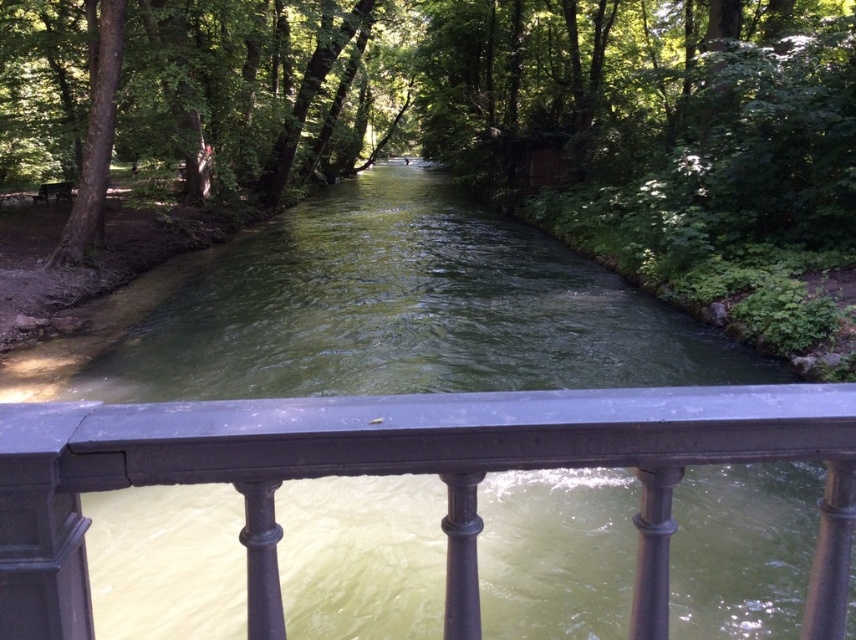
Who is more forward, (x=747, y=108) or (x=125, y=428)?

Point (x=125, y=428) is more forward.

Is green leafy tree at center to the right of black metal railing at center from the viewer's perspective?

In fact, green leafy tree at center is to the left of black metal railing at center.

Between point (544, 92) and point (807, 428), which one is positioned behind?

Positioned behind is point (544, 92).

Where is `green leafy tree at center`? green leafy tree at center is located at coordinates [x=453, y=100].

Between black metal railing at center and green leafy tree at left, which one appears on the left side from the viewer's perspective?

Positioned to the left is green leafy tree at left.

Between point (300, 410) and point (104, 189), which one is positioned in front?

Positioned in front is point (300, 410).

Where is `black metal railing at center`? This screenshot has width=856, height=640. black metal railing at center is located at coordinates pyautogui.click(x=403, y=472).

Is point (399, 0) farther from viewer compared to point (74, 250)?

Yes, it is.

Which is below, green leafy tree at center or green leafy tree at left?

green leafy tree at left is below.

Where is `green leafy tree at center`? Image resolution: width=856 pixels, height=640 pixels. green leafy tree at center is located at coordinates (453, 100).